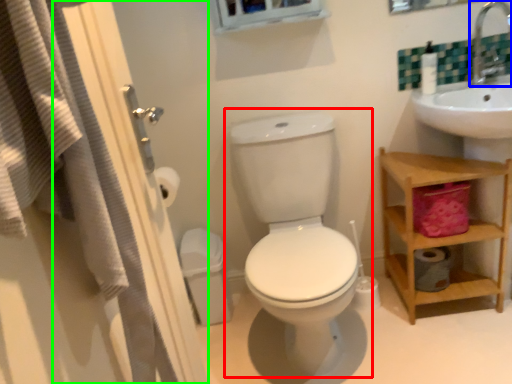
Question: Which is nearer to the toilet (highlighted by a red box)? faucet (highlighted by a blue box) or screen door (highlighted by a green box).

Choices:
 (A) faucet
 (B) screen door

Answer: (B)